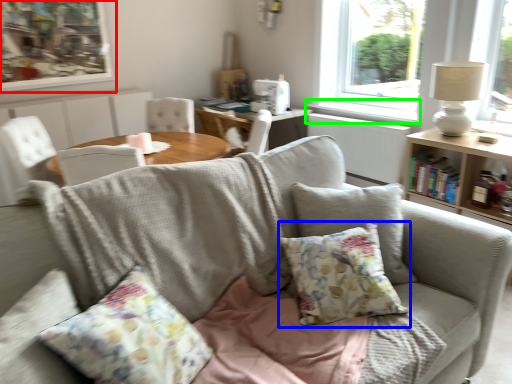
Question: Which object is the closest to the picture frame (highlighted by a red box)? Choose among these: pillow (highlighted by a blue box) or window sill (highlighted by a green box).

Choices:
 (A) pillow
 (B) window sill

Answer: (B)